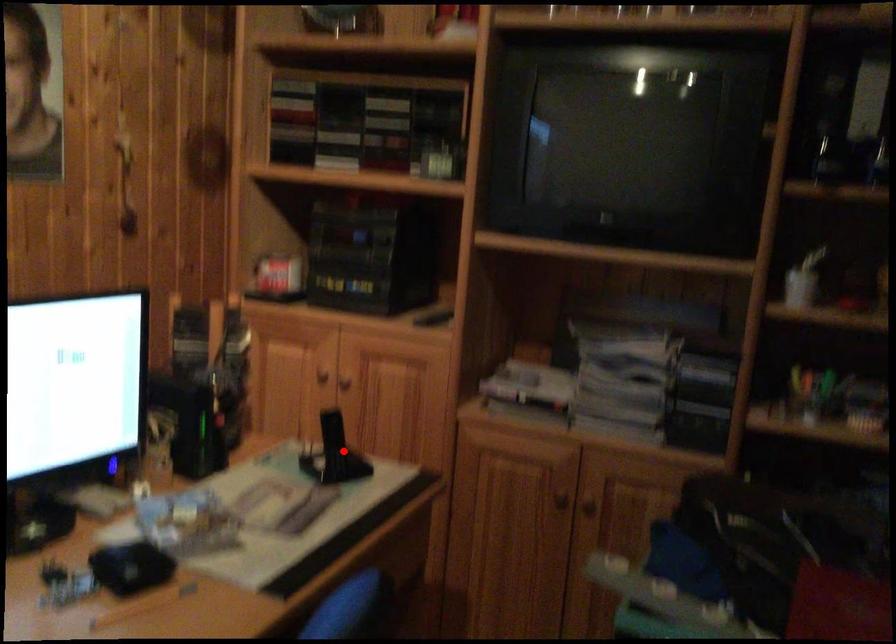
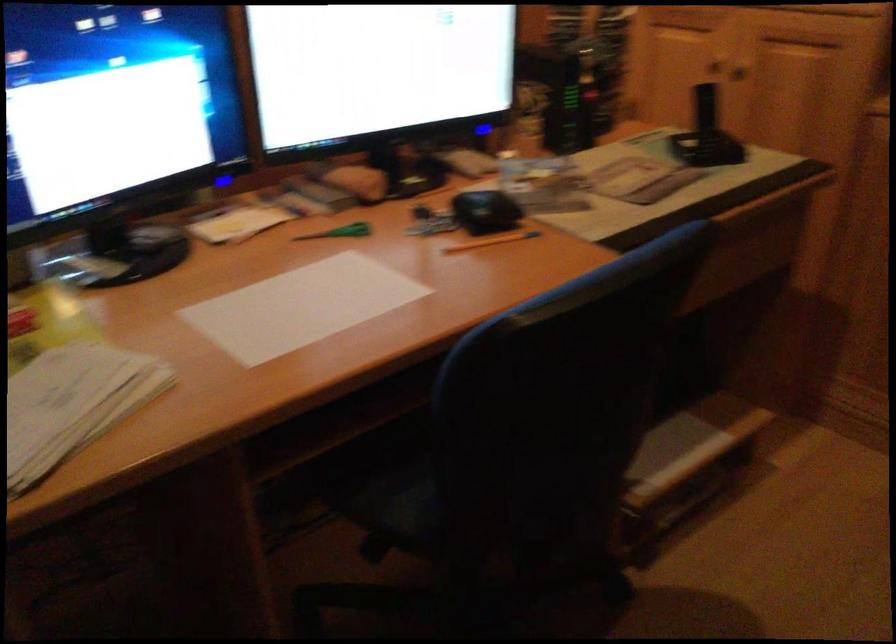
Locate, in the second image, the point that corresponds to the highlighted location in the first image.

(705, 135)